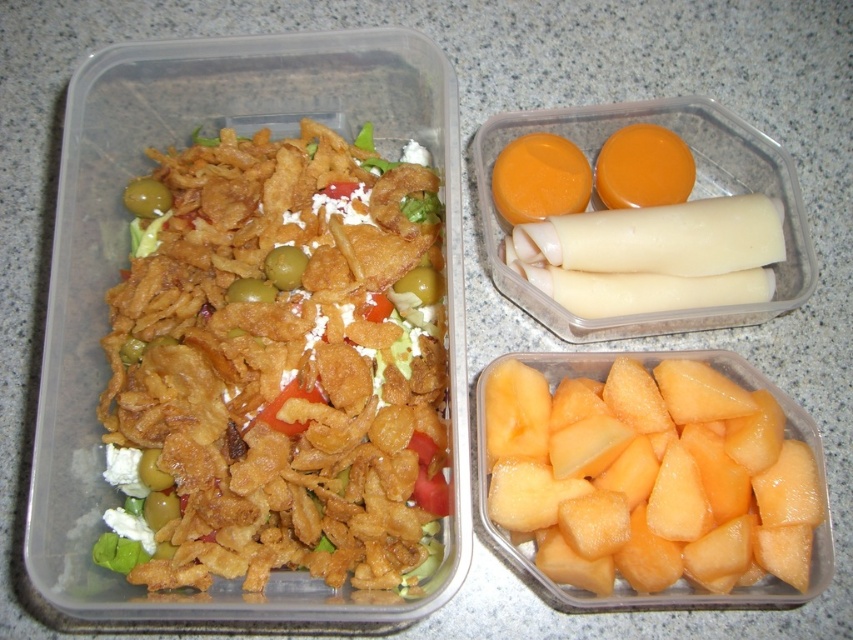
Is golden crispy chips at center shorter than yellowish-orange flesh at lower right?

No.

Based on the photo, who is more distant from viewer, (146, 452) or (538, 432)?

Point (538, 432)

Between point (258, 202) and point (515, 476), which one is positioned in front?

Point (515, 476) is more forward.

The height and width of the screenshot is (640, 853). In order to click on golden crispy chips at center in this screenshot , I will do `click(279, 364)`.